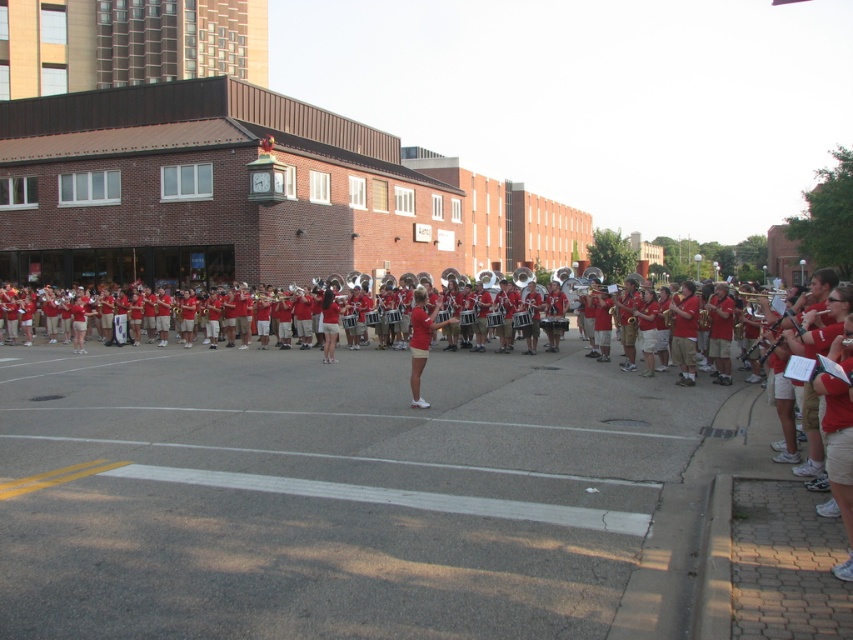
Question: Which of the following is the farthest from the observer?

Choices:
 (A) (724, 493)
 (B) (320, 312)

Answer: (B)

Question: Is red smooth uniform at center to the right of matte red uniform at center from the viewer's perspective?

Choices:
 (A) no
 (B) yes

Answer: (A)

Question: Where is red cotton shorts at lower right located in relation to matte red shorts at center in the image?

Choices:
 (A) right
 (B) left

Answer: (A)

Question: Which of the following is the farthest from the observer?

Choices:
 (A) (834, 387)
 (B) (421, 300)
 (C) (335, 326)
 (D) (271, 589)

Answer: (C)

Question: Can you confirm if red smooth uniform at center is smaller than matte red uniform at center?

Choices:
 (A) yes
 (B) no

Answer: (B)

Question: Among these objects, which one is farthest from the camera?

Choices:
 (A) matte red shorts at center
 (B) matte red uniform at center
 (C) red cotton shorts at lower right

Answer: (A)